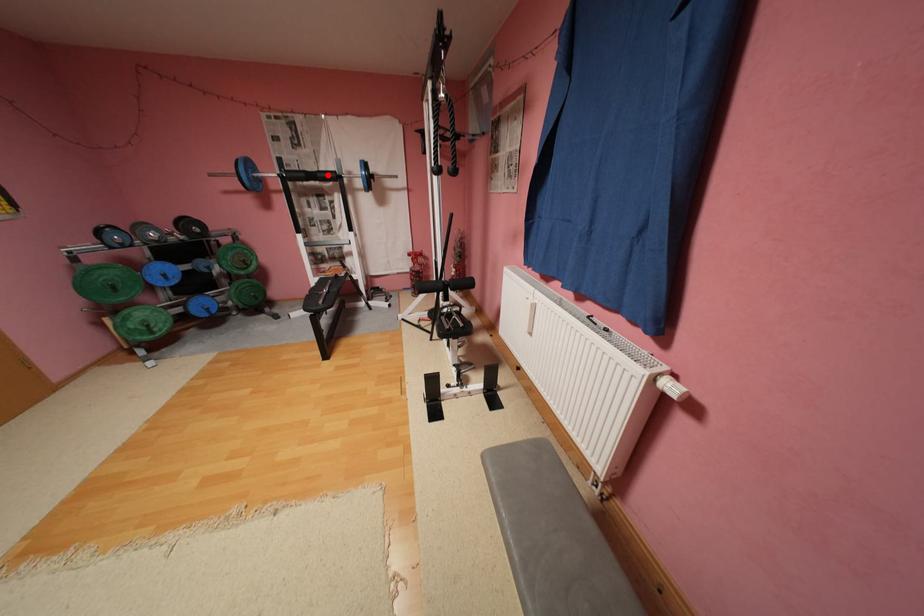
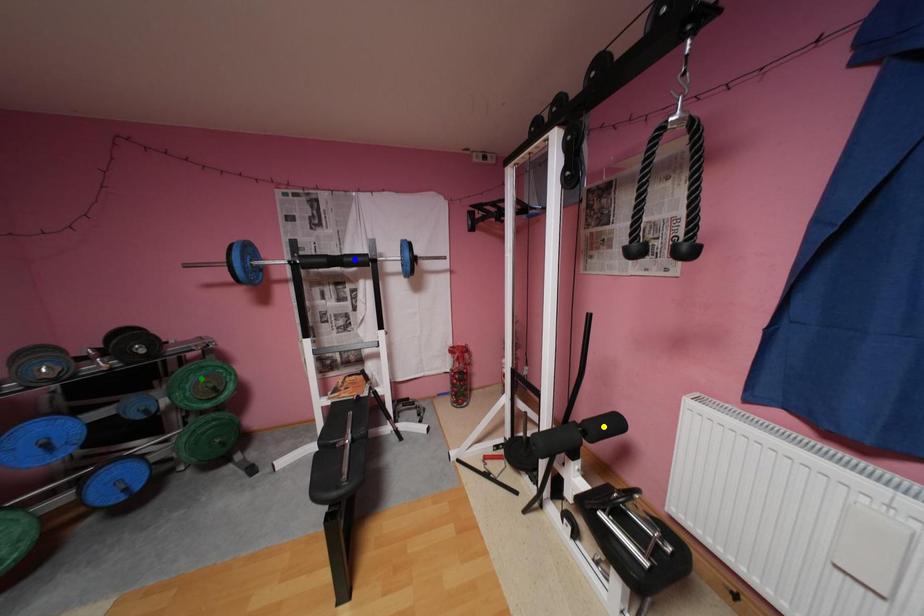
Question: I am providing you with two images of the same scene from different viewpoints. A red point is marked on the first image. You are given multiple points on the second image. Can you choose the point in image 2 that corresponds to the point in image 1?

Choices:
 (A) blue point
 (B) green point
 (C) yellow point

Answer: (A)